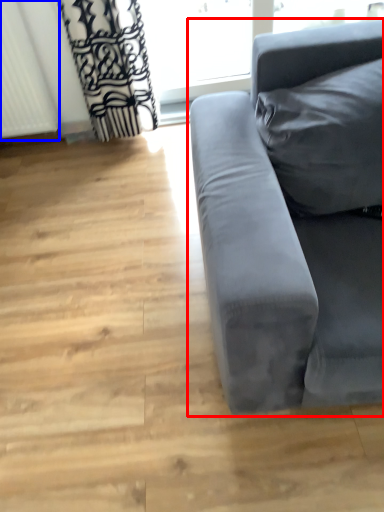
Question: Which of the following is the closest to the observer, studio couch (highlighted by a red box) or radiator (highlighted by a blue box)?

Choices:
 (A) studio couch
 (B) radiator

Answer: (A)